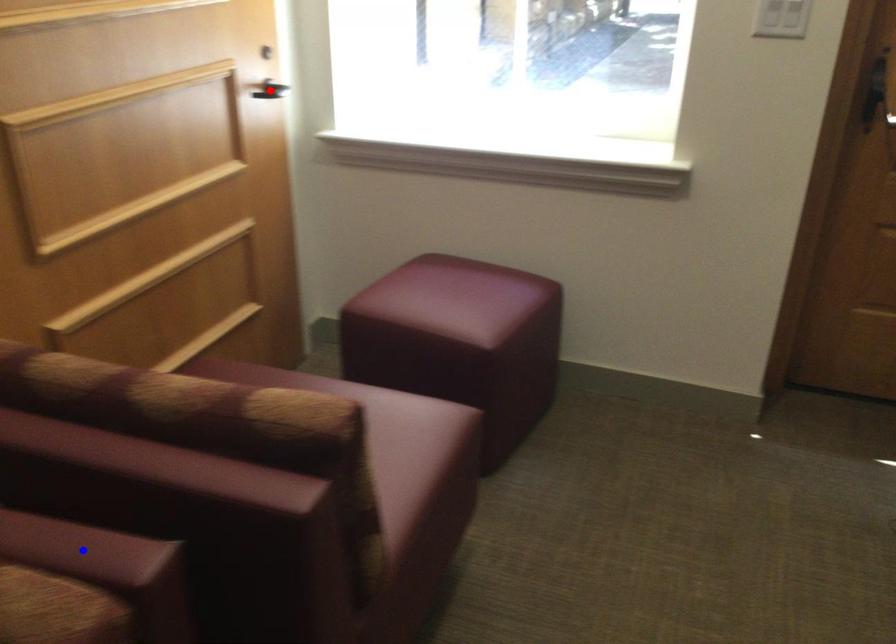
Question: Which of the two points in the image is closer to the camera?

Choices:
 (A) Blue point is closer.
 (B) Red point is closer.

Answer: (A)